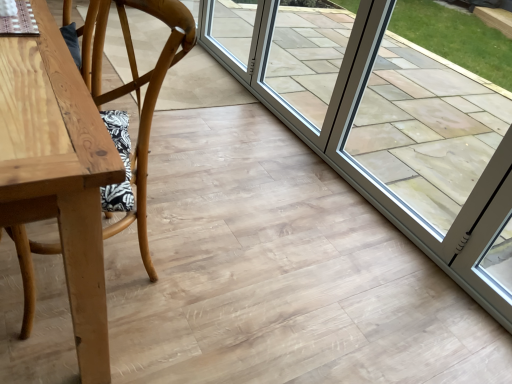
Find the location of a particular element. free point to the right of wooden chair at left is located at coordinates (216, 279).